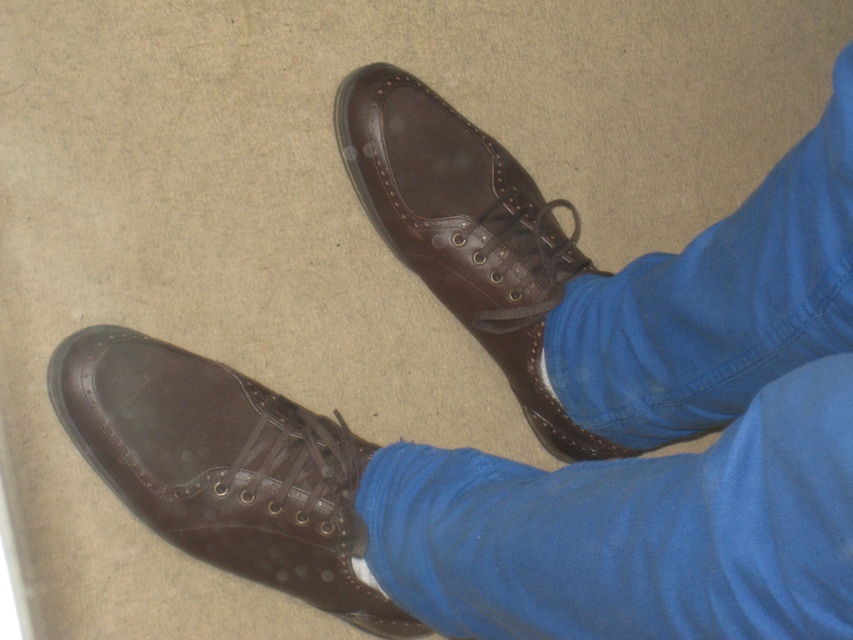
Question: Can you confirm if shiny brown shoe at lower left is wider than shiny brown leather shoe at center?

Choices:
 (A) no
 (B) yes

Answer: (B)

Question: Which point is farther from the camera taking this photo?

Choices:
 (A) (468, 296)
 (B) (310, 454)

Answer: (A)

Question: In this image, where is shiny brown shoe at lower left located relative to shiny brown leather shoe at center?

Choices:
 (A) above
 (B) below

Answer: (B)

Question: Is shiny brown shoe at lower left bigger than shiny brown leather shoe at center?

Choices:
 (A) no
 (B) yes

Answer: (A)